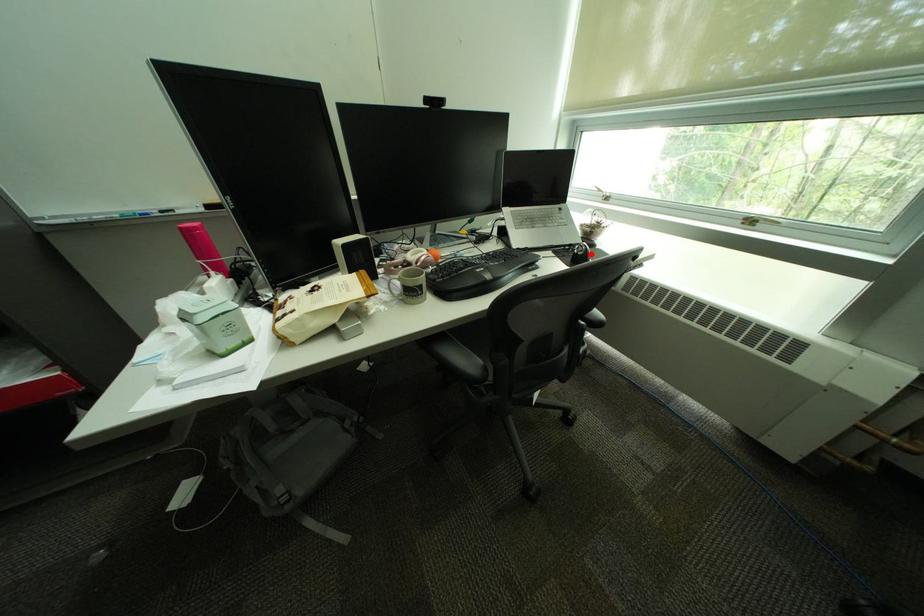
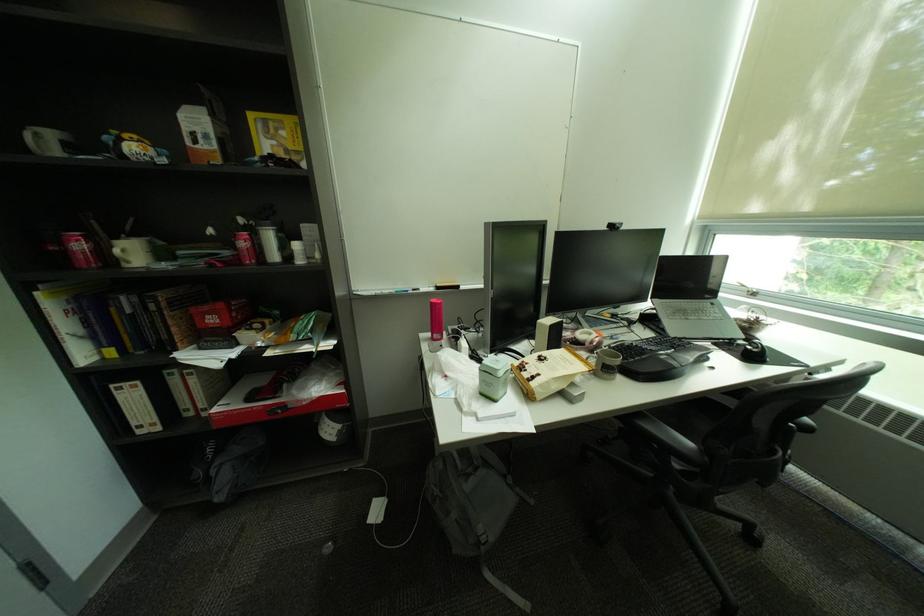
Locate, in the second image, the point that corresponds to the highlighted location in the first image.

(766, 352)